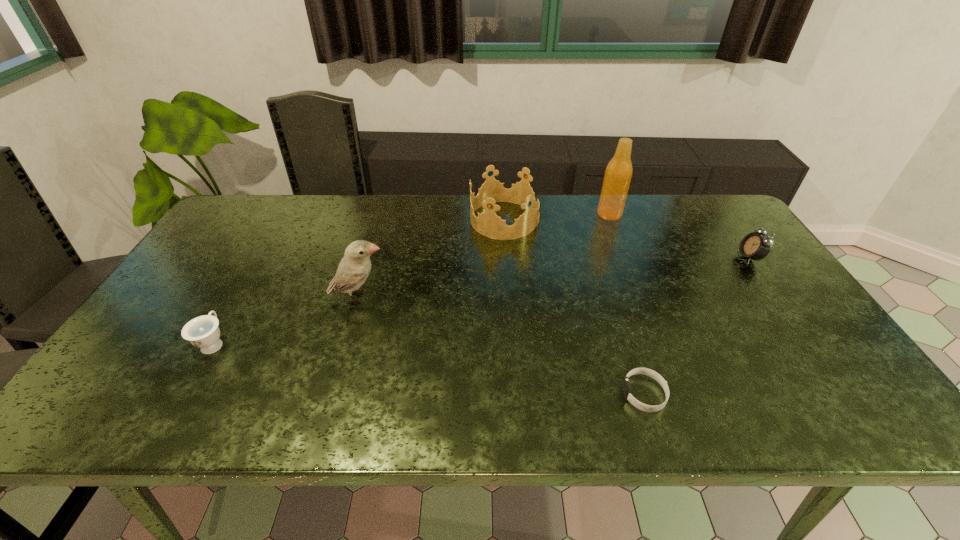
At what (x,y) coordinates should I click in order to perform the action: click on the tallest object. Please return your answer as a coordinate pair (x, y). This screenshot has width=960, height=540. Looking at the image, I should click on (618, 173).

Locate an element on the screen. The height and width of the screenshot is (540, 960). bird is located at coordinates (354, 268).

Find the location of `the fourth farthest object`. the fourth farthest object is located at coordinates (354, 268).

Find the location of `the fourth object from right to left`. the fourth object from right to left is located at coordinates (488, 224).

Locate an element on the screen. Image resolution: width=960 pixels, height=540 pixels. tiara is located at coordinates (488, 224).

Find the location of a particular element. The width and height of the screenshot is (960, 540). the third farthest object is located at coordinates (755, 245).

Image resolution: width=960 pixels, height=540 pixels. I want to click on alarm clock, so click(755, 245).

You are a GUI agent. You are given a task and a screenshot of the screen. Output one action in this format:
    pyautogui.click(x=<x>, y=<y>)
    Task: Click on the leftmost object
    Image resolution: width=960 pixels, height=540 pixels.
    Given the screenshot: What is the action you would take?
    coord(203,332)

Identify the location of teacup. This screenshot has width=960, height=540. (203, 332).

Where is `wristband`? The height and width of the screenshot is (540, 960). wristband is located at coordinates (626, 388).